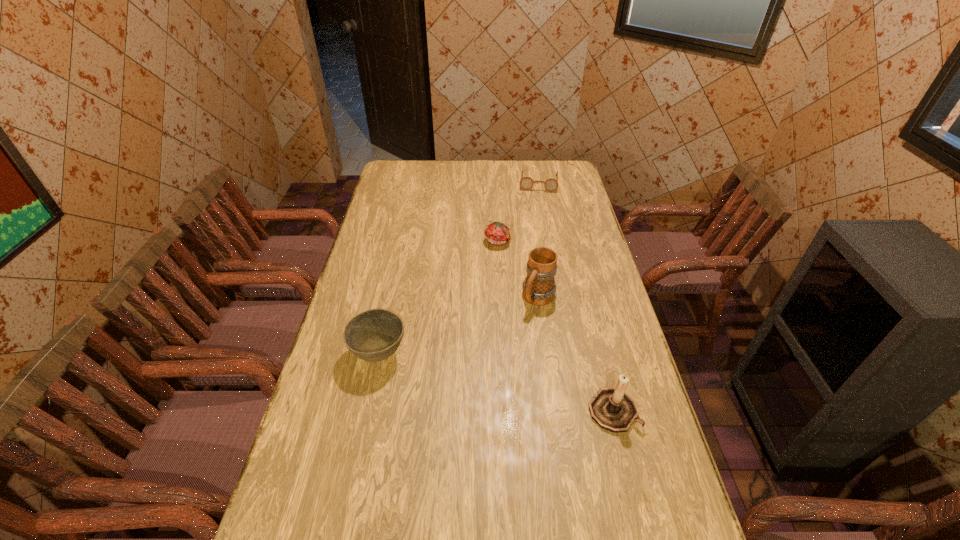
At what (x,y) coordinates should I click in order to perform the action: click on the third tallest object. Please return your answer as a coordinate pair (x, y). Image resolution: width=960 pixels, height=540 pixels. Looking at the image, I should click on pyautogui.click(x=373, y=335).

Where is `the second nearest object`? Image resolution: width=960 pixels, height=540 pixels. the second nearest object is located at coordinates (373, 335).

The width and height of the screenshot is (960, 540). Find the location of `the nearest object`. the nearest object is located at coordinates (613, 409).

Identify the location of tomato. (497, 233).

Image resolution: width=960 pixels, height=540 pixels. I want to click on the fourth tallest object, so click(497, 233).

You are a GUI agent. You are given a task and a screenshot of the screen. Output one action in this format:
    pyautogui.click(x=<x>, y=<y>)
    Task: Click on the mug
    The width and height of the screenshot is (960, 540).
    Given the screenshot: What is the action you would take?
    pyautogui.click(x=539, y=287)

Locate an element on the screen. the shortest object is located at coordinates [526, 183].

Where is `the farthest object`? the farthest object is located at coordinates (526, 183).

Identify the location of blank space located 0.250m on the back of the leftmost object. This screenshot has height=540, width=960. (395, 280).

Where is `vacant area situated on the front of the nearest object`? This screenshot has width=960, height=540. vacant area situated on the front of the nearest object is located at coordinates (635, 497).